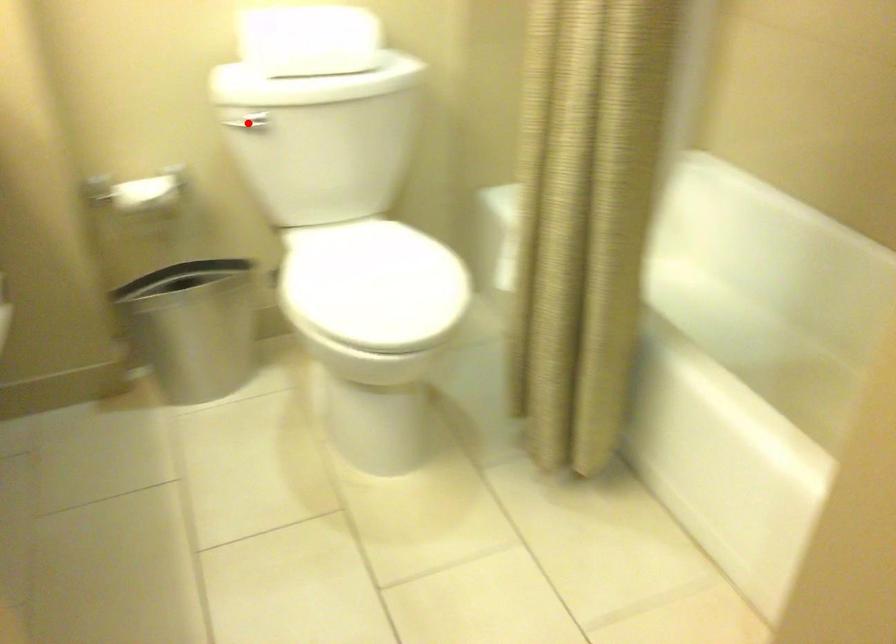
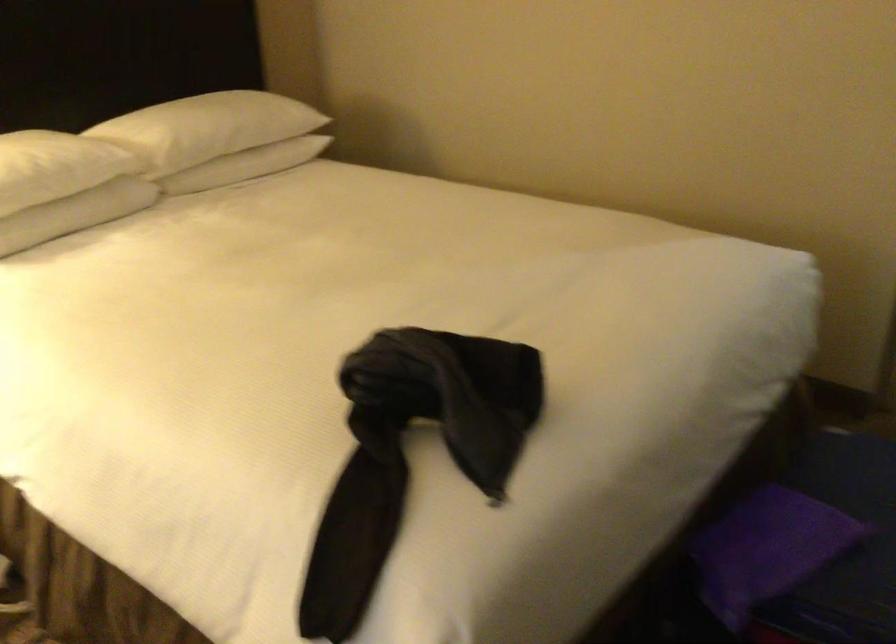
Question: I am providing you with two images of the same scene from different viewpoints. A red point is marked on the first image. At the location where the point appears in image 1, is it still visible in image 2?

Choices:
 (A) Yes
 (B) No

Answer: (B)